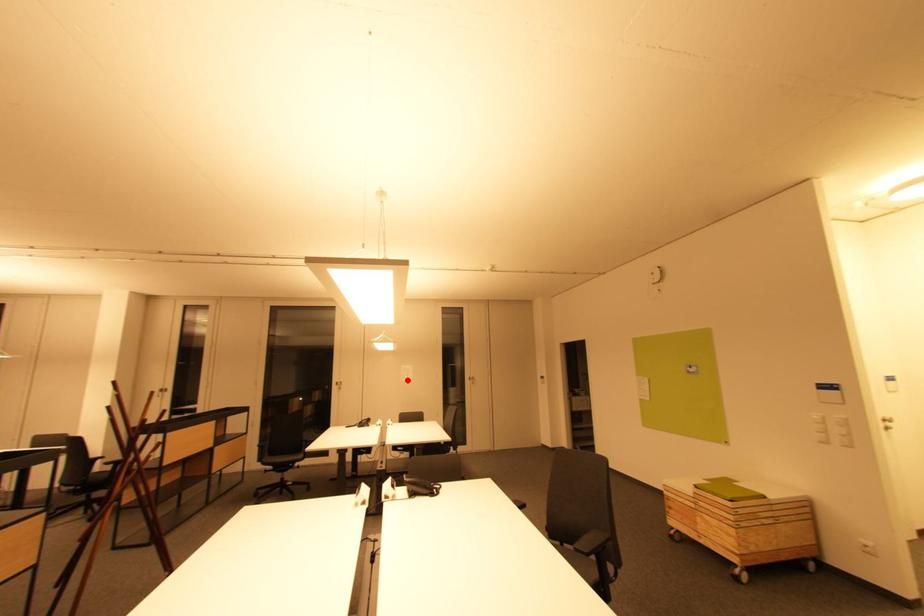
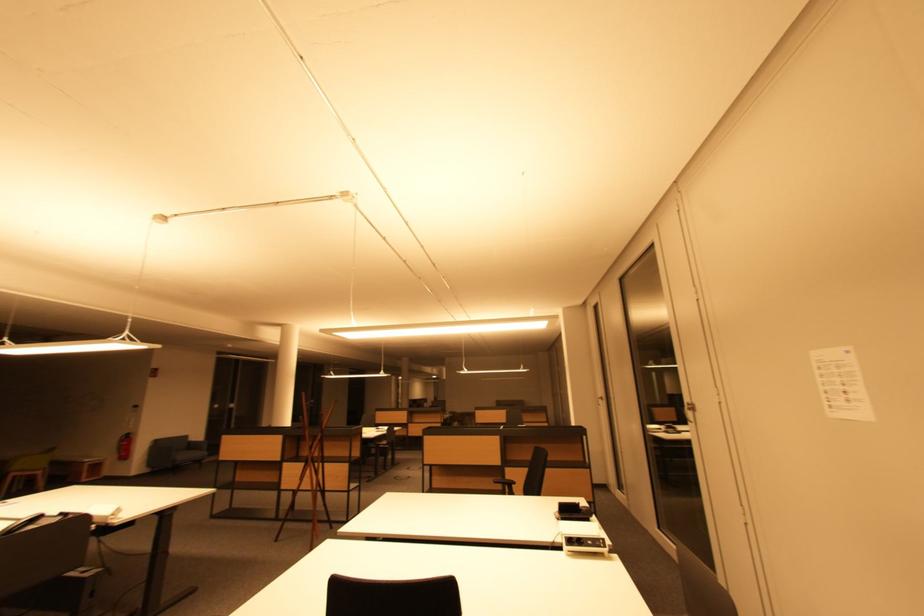
Question: I am providing you with two images of the same scene from different viewpoints. A red point is shown in image1. For the corresponding object point in image2, is it positioned nearer or farther from the camera?

Choices:
 (A) Nearer
 (B) Farther

Answer: (A)